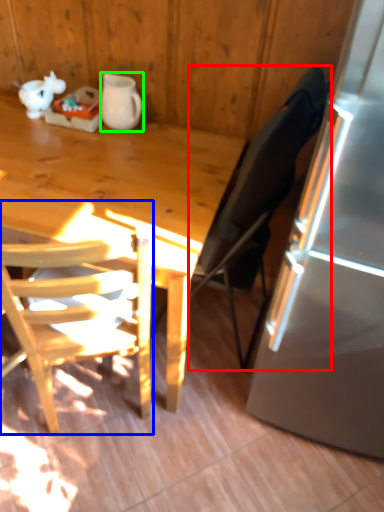
Question: Considering the real-world distances, which object is closest to chair (highlighted by a red box)? chair (highlighted by a blue box) or pitcher (highlighted by a green box).

Choices:
 (A) chair
 (B) pitcher

Answer: (A)